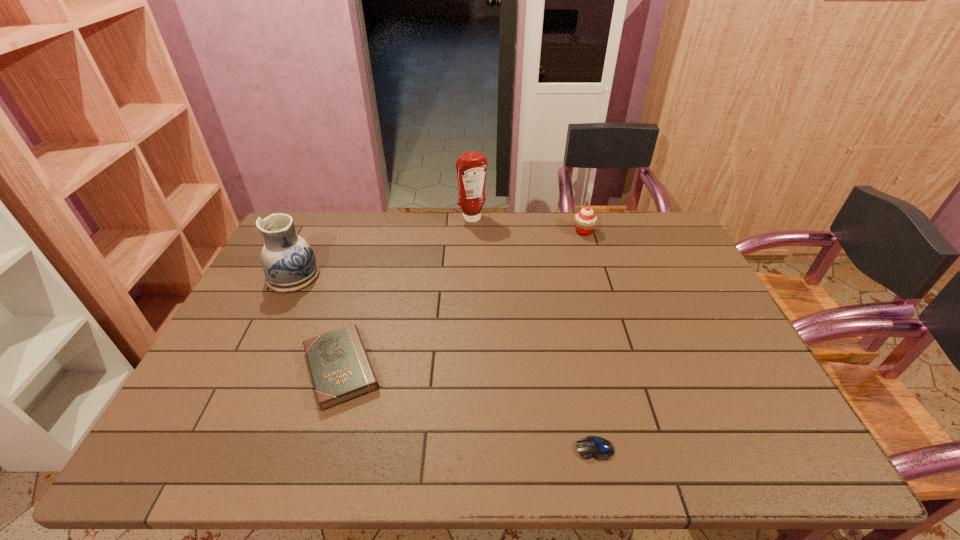
In order to click on free space between the cupcake and the second tallest object in this screenshot , I will do click(x=439, y=254).

Where is `unoccupied position between the condiment and the cupcake`? The height and width of the screenshot is (540, 960). unoccupied position between the condiment and the cupcake is located at coordinates (528, 225).

Locate an element on the screen. free point between the second object from left to right and the rightmost object is located at coordinates (463, 300).

The width and height of the screenshot is (960, 540). What are the coordinates of `free point between the leftmost object and the computer mouse` in the screenshot? It's located at (444, 362).

You are a GUI agent. You are given a task and a screenshot of the screen. Output one action in this format:
    pyautogui.click(x=<x>, y=<y>)
    Task: Click on the empty location between the third farthest object and the third tallest object
    This screenshot has height=540, width=960.
    Given the screenshot: What is the action you would take?
    pyautogui.click(x=439, y=254)

Locate an element on the screen. vacant area between the second object from right to left and the Bible is located at coordinates (468, 408).

Where is `object identified as the fourth closest to the third tallest object`? The width and height of the screenshot is (960, 540). object identified as the fourth closest to the third tallest object is located at coordinates (289, 264).

Identify which object is the nearest to the computer mouse. Please provide its 2D coordinates. Your answer should be formatted as a tuple, i.e. [(x, y)], where the tuple contains the x and y coordinates of a point satisfying the conditions above.

[(340, 368)]

This screenshot has width=960, height=540. What are the coordinates of `free space that satisfies the following two spatial constraints: 1. on the front side of the pottery; 2. on the left side of the second object from left to right` in the screenshot? It's located at (249, 368).

Locate an element on the screen. The height and width of the screenshot is (540, 960). free location that satisfies the following two spatial constraints: 1. on the back side of the rightmost object; 2. on the right side of the second nearest object is located at coordinates (x=381, y=232).